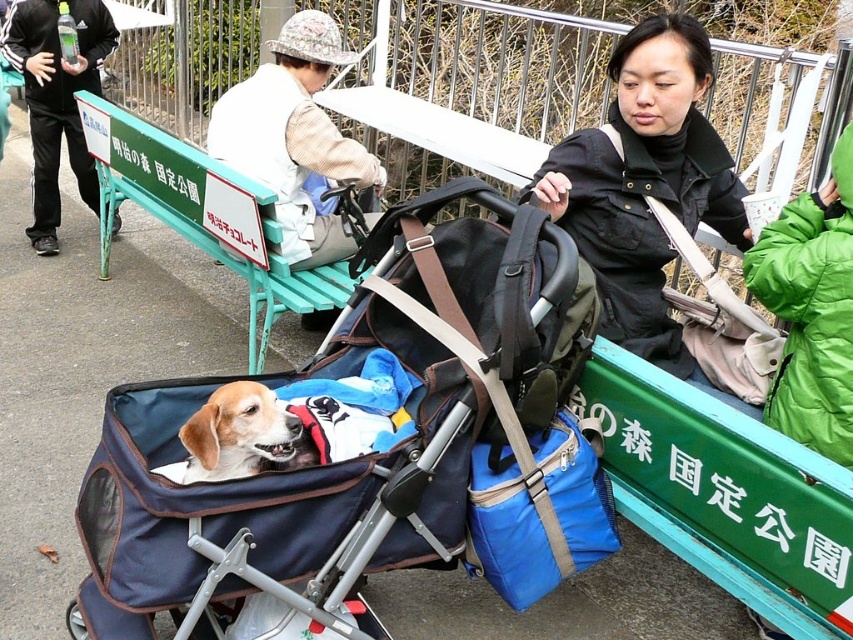
Question: Which point is closer to the camera taking this photo?

Choices:
 (A) (273, 442)
 (B) (602, 481)
 (C) (840, 288)
 (D) (495, 531)

Answer: (A)

Question: Is blue fabric baby carriage at center wider than black fabric jacket at upper center?

Choices:
 (A) no
 (B) yes

Answer: (B)

Question: Can you confirm if blue fabric cooler at center is positioned below light brown fur at center?

Choices:
 (A) yes
 (B) no

Answer: (A)

Question: Based on their relative distances, which object is farther from the blue fabric baby carriage at center?

Choices:
 (A) blue fabric cooler at center
 (B) black fabric jacket at upper center
 (C) light brown fur at center

Answer: (B)

Question: Does black fabric jacket at upper center have a lesser width compared to light brown fur at center?

Choices:
 (A) no
 (B) yes

Answer: (A)

Question: Which object appears closest to the camera in this image?

Choices:
 (A) light brown fur at center
 (B) green down jacket at upper right
 (C) green plastic bench at upper center
 (D) white cotton jacket at upper center

Answer: (A)